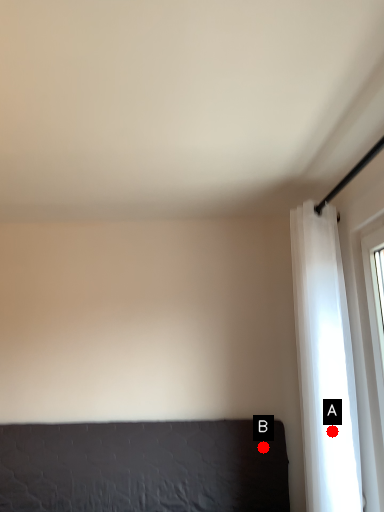
Question: Two points are circled on the image, labeled by A and B beside each circle. Which of the following is the closest to the observer?

Choices:
 (A) A is closer
 (B) B is closer

Answer: (A)